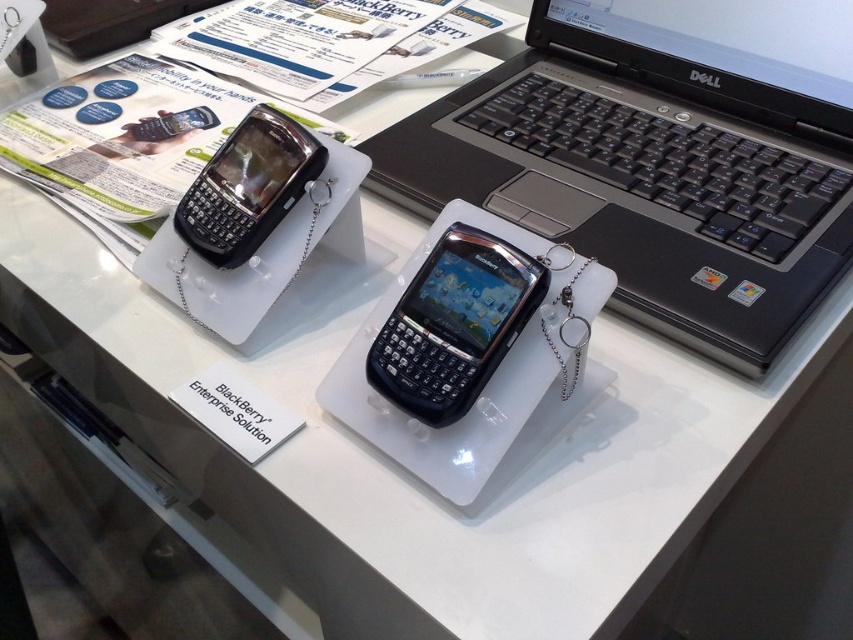
You are setting up a display for a tech event and need to arrange two black glossy devices. You have a black glossy smartphone at center and a black glossy phone at center. Based on their sizes, which one should you place on the higher shelf to ensure stability?

The black glossy smartphone at center has a lesser height compared to the black glossy phone at center. To ensure stability, place the taller black glossy phone at center on the higher shelf since it can support its own weight better due to its size.

You are setting up a display for a tech event and need to place a black matte laptop at center and a black glossy smartphone at center on a table. The table has a width of 10 inches. Can both items fit side by side without overlapping?

The black matte laptop at center and black glossy smartphone at center are 9.71 inches apart. Since the table is 10 inches wide, they can fit side by side with a small gap remaining.

You are setting up a display for a tech event and need to place two black glossy devices side by side. You have a black glossy smartphone at center and a black glossy phone at center. Based on their thickness, which device should you place closer to the edge of the display stand to ensure stability?

The black glossy smartphone at center is thinner than the black glossy phone at center. To ensure stability, place the thicker black glossy phone at center closer to the edge of the display stand as it has a larger base area for support.